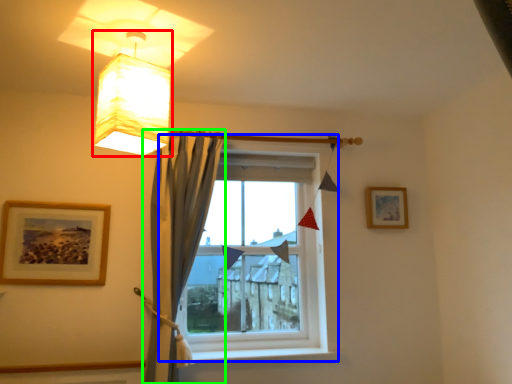
Question: Which object is positioned farthest from lamp (highlighted by a red box)? Select from window (highlighted by a blue box) and curtain (highlighted by a green box).

Choices:
 (A) window
 (B) curtain

Answer: (A)